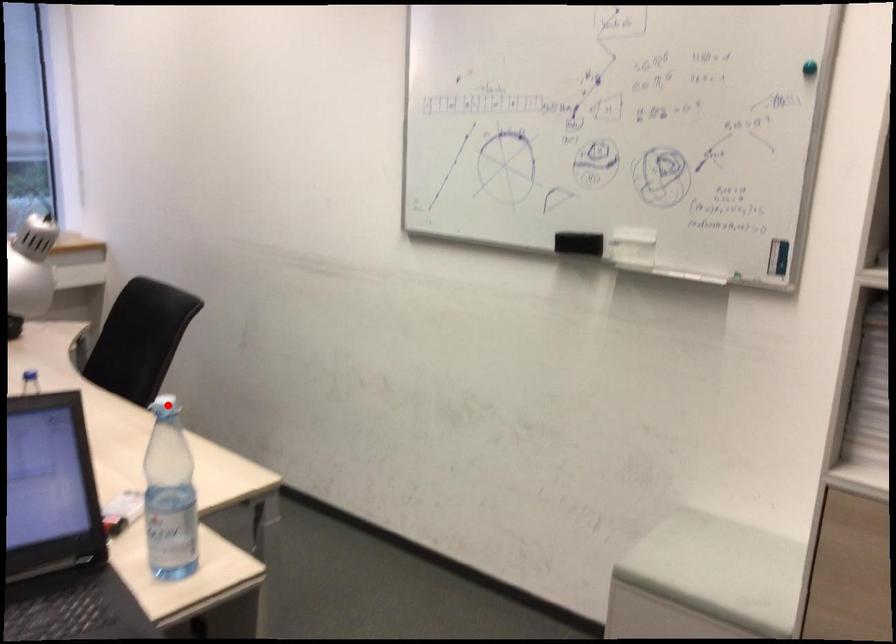
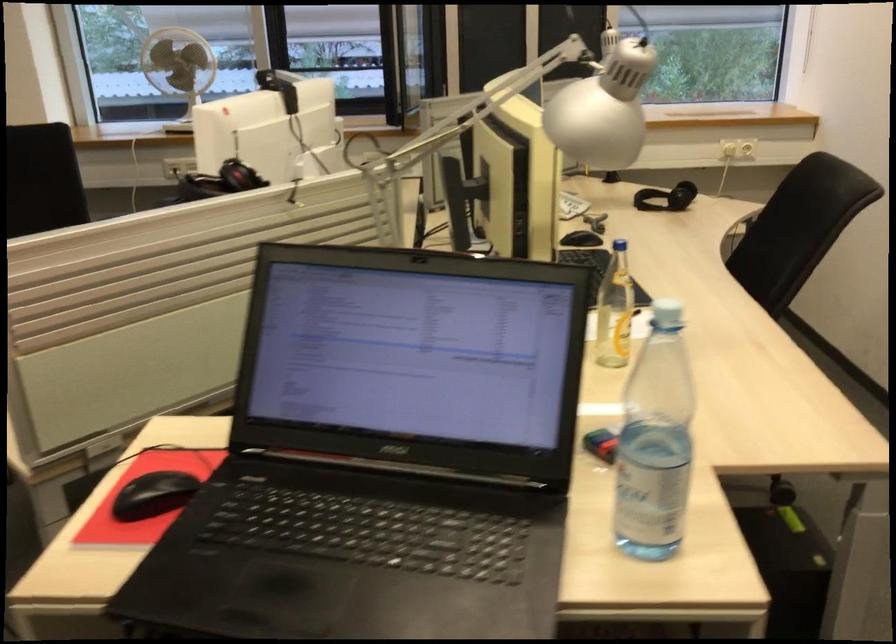
The point at the highlighted location is marked in the first image. Where is the corresponding point in the second image?

(666, 313)